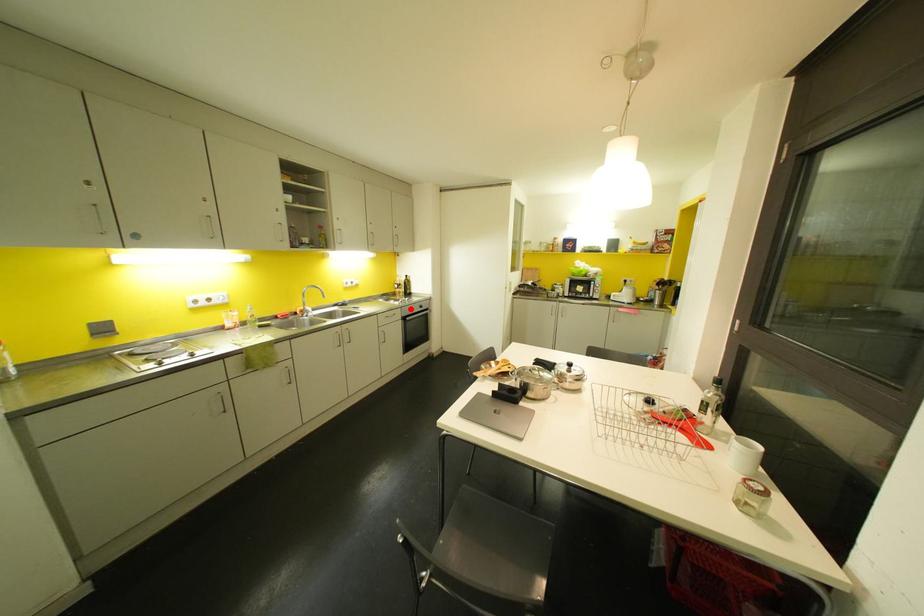
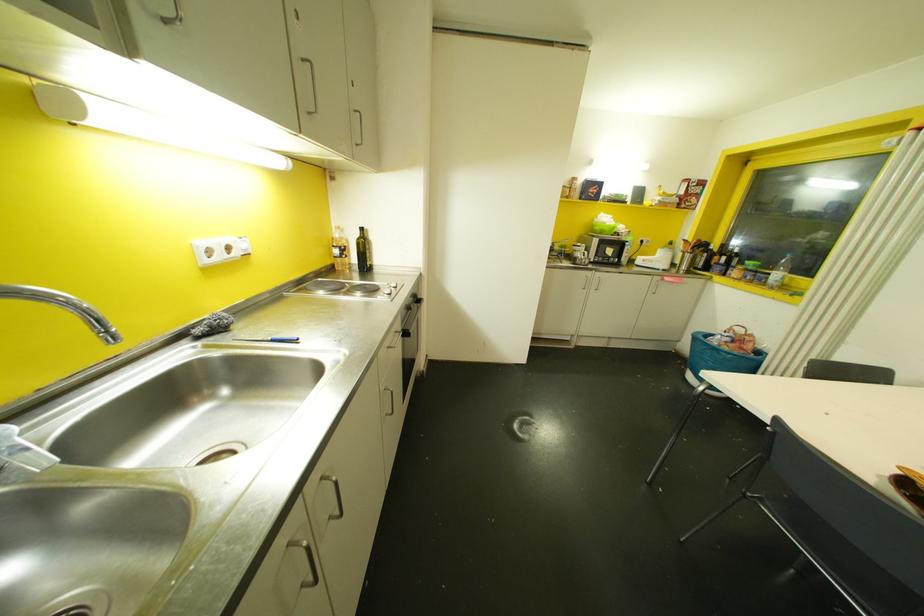
Locate, in the second image, the point that corresponds to the highlighted location in the first image.

(407, 307)